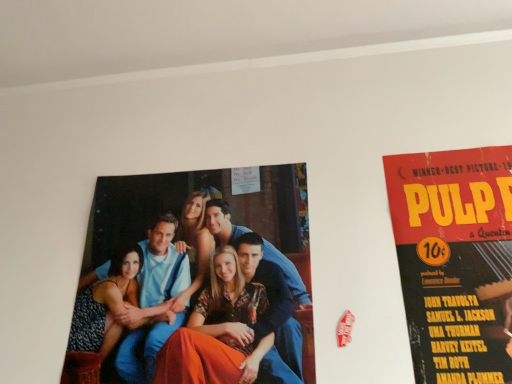
The image size is (512, 384). Describe the element at coordinates (194, 217) in the screenshot. I see `matte blue fabric poster at upper left` at that location.

You are a GUI agent. You are given a task and a screenshot of the screen. Output one action in this format:
    pyautogui.click(x=<x>, y=<y>)
    Task: Click on the matte blue fabric poster at upper left
    The width and height of the screenshot is (512, 384).
    Given the screenshot: What is the action you would take?
    pyautogui.click(x=194, y=217)

Identify the location of matte blue fabric poster at upper left. (194, 217).